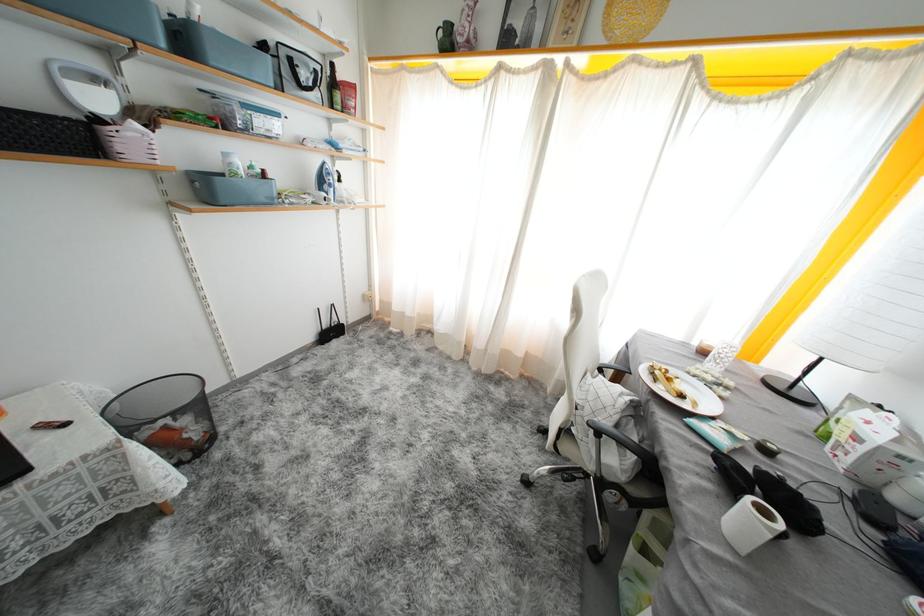
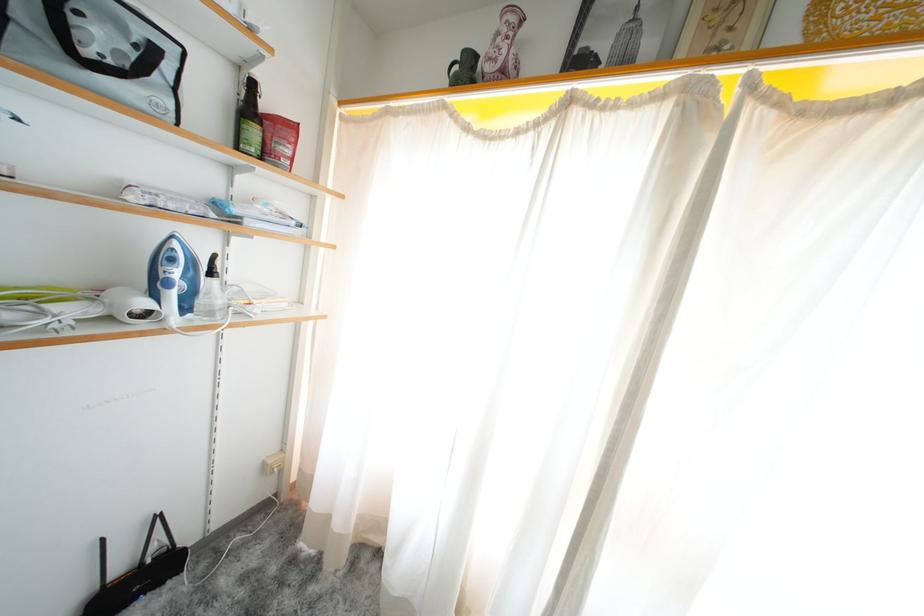
Find the pixel in the second image that matches the point at 337,337 in the first image.

(143, 586)